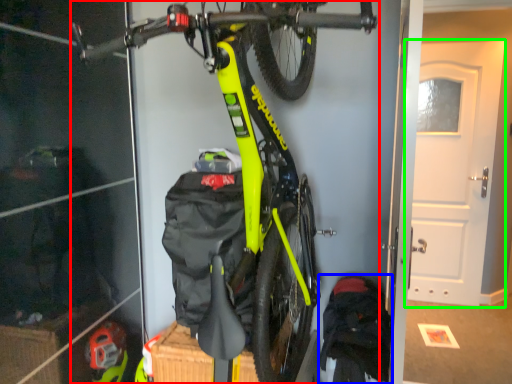
Question: Considering the real-world distances, which object is farthest from bicycle (highlighted by a red box)? backpack (highlighted by a blue box) or door (highlighted by a green box)?

Choices:
 (A) backpack
 (B) door

Answer: (B)